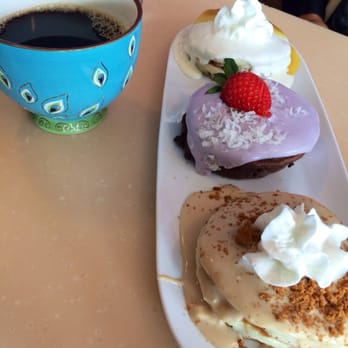
Find the location of a particular element. tabletop is located at coordinates (41, 244).